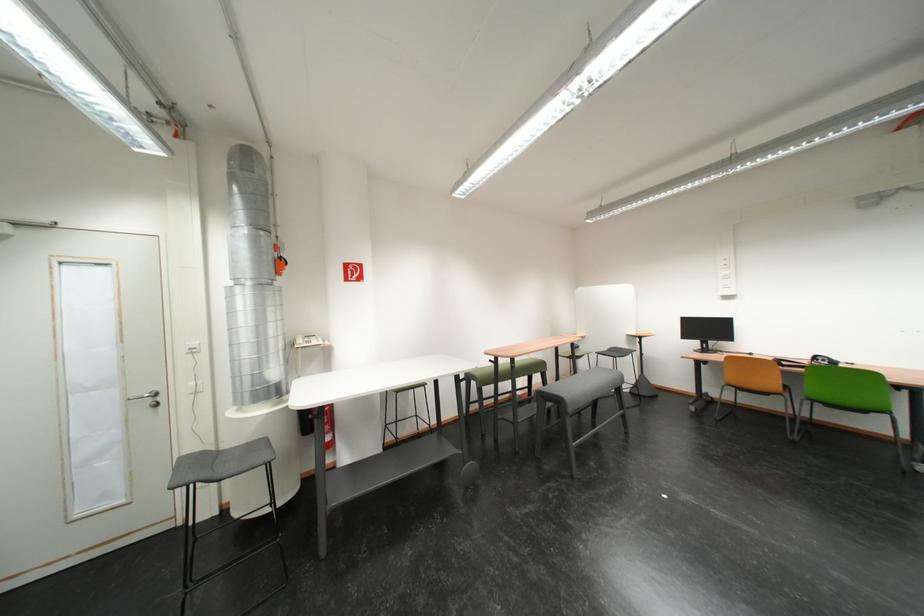
Find where to press the white light switch. Please return your answer as a coordinate pair (x, y).

(191, 347)